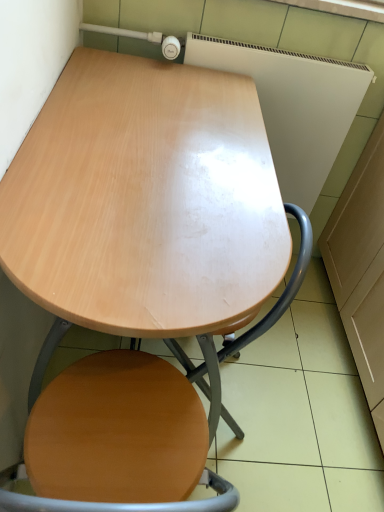
Question: Would you say light wood table at center is to the left or to the right of wooden swivel chair at center in the picture?

Choices:
 (A) left
 (B) right

Answer: (A)

Question: Is light wood table at center spatially inside wooden swivel chair at center, or outside of it?

Choices:
 (A) inside
 (B) outside

Answer: (B)

Question: From a real-world perspective, is light wood table at center above or below wooden swivel chair at center?

Choices:
 (A) above
 (B) below

Answer: (A)

Question: From a real-world perspective, is wooden swivel chair at center positioned above or below light wood table at center?

Choices:
 (A) above
 (B) below

Answer: (B)

Question: Is wooden swivel chair at center taller or shorter than light wood table at center?

Choices:
 (A) short
 (B) tall

Answer: (A)

Question: Based on their positions, is wooden swivel chair at center located to the left or right of light wood table at center?

Choices:
 (A) right
 (B) left

Answer: (A)

Question: Considering the positions of point (306, 241) and point (54, 311), is point (306, 241) closer or farther from the camera than point (54, 311)?

Choices:
 (A) closer
 (B) farther

Answer: (B)